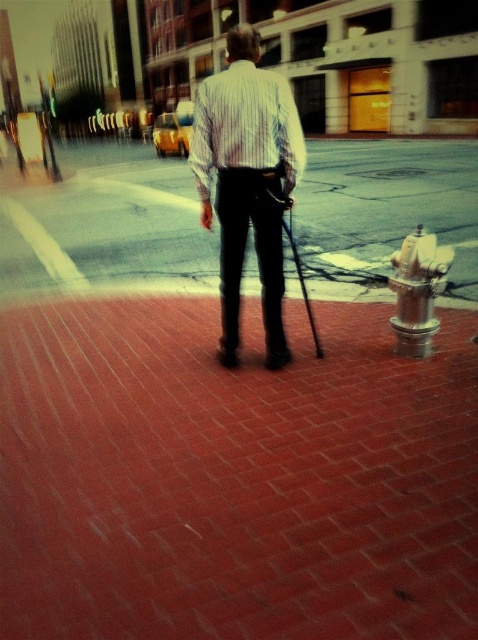
Looking at this image, who is shorter, brick at center or white striped shirt at center?

brick at center

Is brick at center to the left of white striped shirt at center from the viewer's perspective?

In fact, brick at center is to the right of white striped shirt at center.

Between point (105, 404) and point (263, 168), which one is positioned behind?

The point (105, 404) is behind.

You are a GUI agent. You are given a task and a screenshot of the screen. Output one action in this format:
    pyautogui.click(x=<x>, y=<y>)
    Task: Click on the brick at center
    
    Given the screenshot: What is the action you would take?
    pyautogui.click(x=232, y=477)

Does point (369, 144) lie in front of point (242, 182)?

That is False.

Who is more distant from viewer, (445, 141) or (268, 211)?

The point (445, 141) is more distant.

The image size is (478, 640). Find the location of `brick pavement at center`. brick pavement at center is located at coordinates (106, 221).

Is brick at center behind striped cotton shirt at center?

No, brick at center is in front of striped cotton shirt at center.

Is brick at center in front of striped cotton shirt at center?

Yes, brick at center is closer to the viewer.

Who is more forward, (347, 576) or (260, 108)?

Positioned in front is point (347, 576).

Locate an element on the screen. The height and width of the screenshot is (640, 478). brick at center is located at coordinates (232, 477).